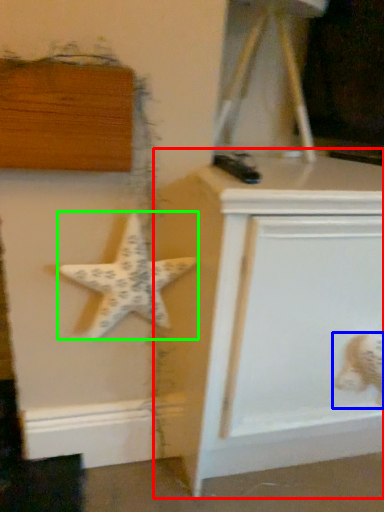
Question: Based on their relative distances, which object is nearer to vanity (highlighted by a red box)? Choose from toy (highlighted by a blue box) and starfish (highlighted by a green box).

Choices:
 (A) toy
 (B) starfish

Answer: (B)